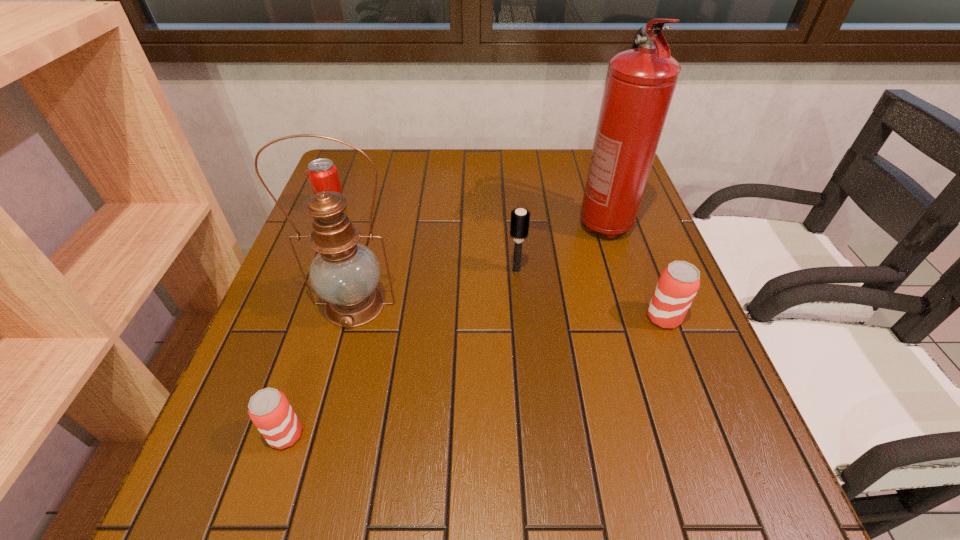
To make them evenly spaced by inserting another beer_can among them, please locate a vacant spot for this new beer_can. Please provide its 2D coordinates. Your answer should be formatted as a tuple, i.e. [(x, y)], where the tuple contains the x and y coordinates of a point satisfying the conditions above.

[(495, 370)]